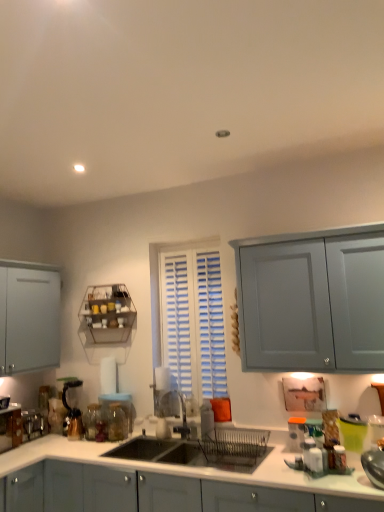
Locate an element on the screen. free space in front of matte black coffee machine at lower left is located at coordinates (59, 444).